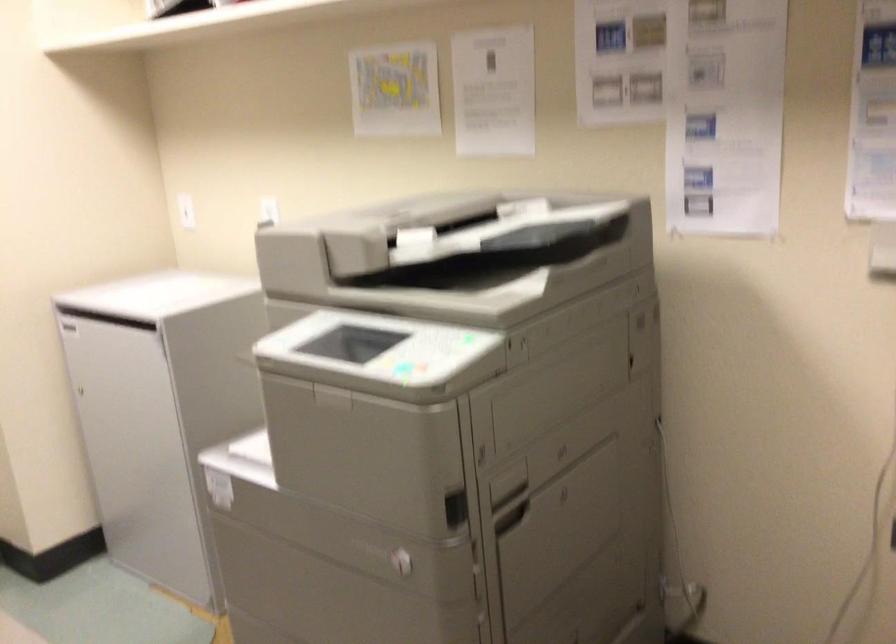
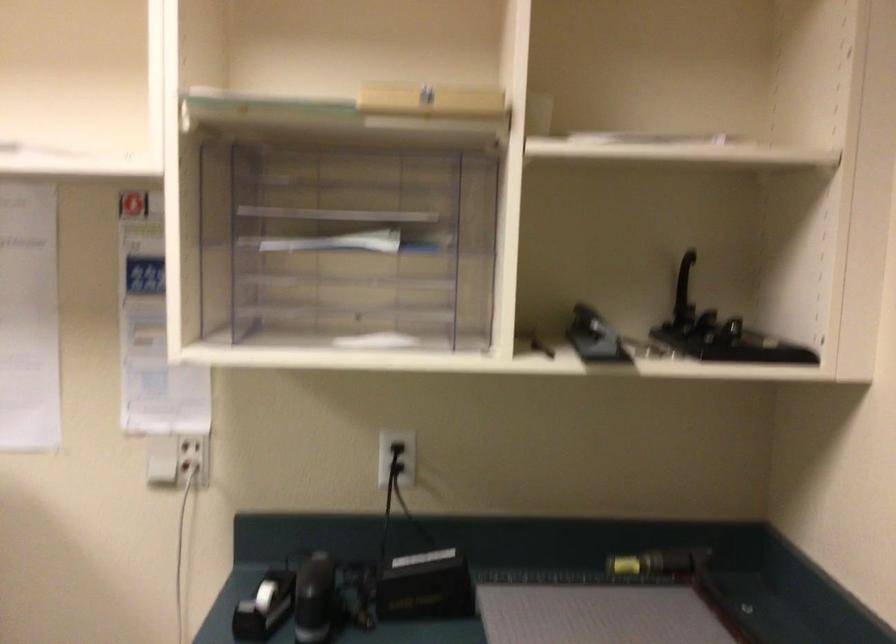
Question: How did the camera likely rotate?

Choices:
 (A) Left
 (B) Right
 (C) Up
 (D) Down

Answer: (B)